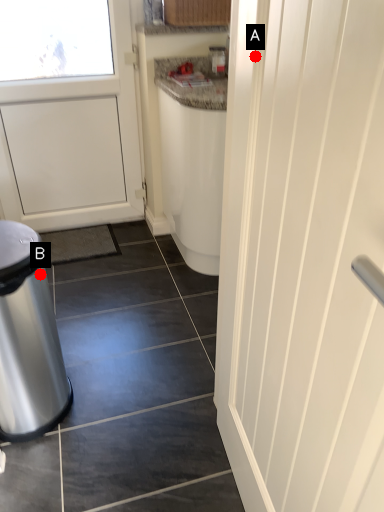
Question: Two points are circled on the image, labeled by A and B beside each circle. Among these points, which one is nearest to the camera?

Choices:
 (A) A is closer
 (B) B is closer

Answer: (A)